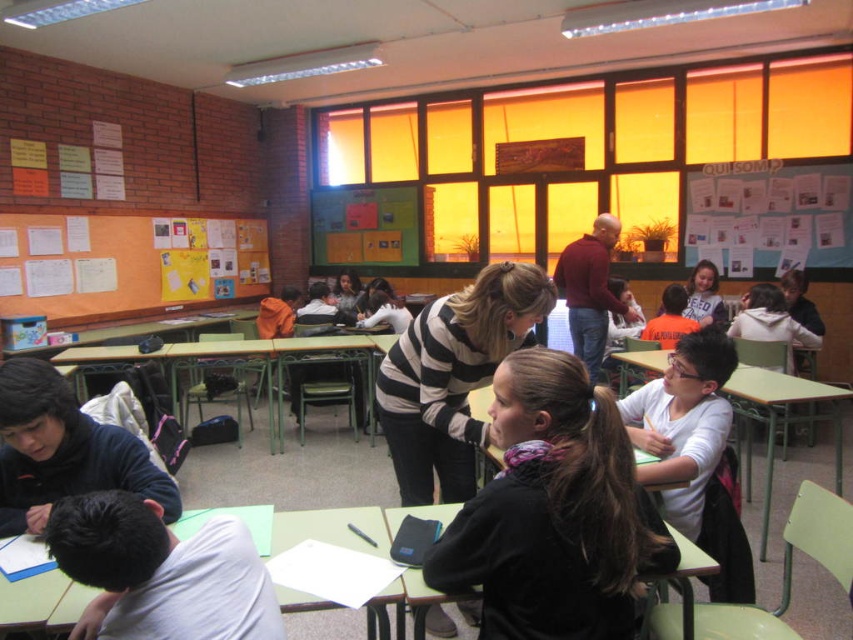
Between maroon sweater at center and matte orange shirt at center, which one is positioned lower?

matte orange shirt at center

Based on the photo, can you confirm if maroon sweater at center is wider than matte orange shirt at center?

Yes, maroon sweater at center is wider than matte orange shirt at center.

Where is `maroon sweater at center`? maroon sweater at center is located at coordinates (590, 291).

Who is higher up, green matte table at lower center or matte orange shirt at center?

matte orange shirt at center

Who is more distant from viewer, (686, 538) or (700, 280)?

The point (700, 280) is behind.

Identify the location of green matte table at lower center. (689, 577).

Can you confirm if green plastic table at center is thinner than matte orange shirt at center?

In fact, green plastic table at center might be wider than matte orange shirt at center.

Who is more distant from viewer, (289,368) or (693,269)?

The point (693,269) is more distant.

Is point (357, 356) less distant than point (699, 298)?

That is True.

You are a GUI agent. You are given a task and a screenshot of the screen. Output one action in this format:
    pyautogui.click(x=<x>, y=<y>)
    Task: Click on the green plastic table at center
    
    Given the screenshot: What is the action you would take?
    pyautogui.click(x=326, y=364)